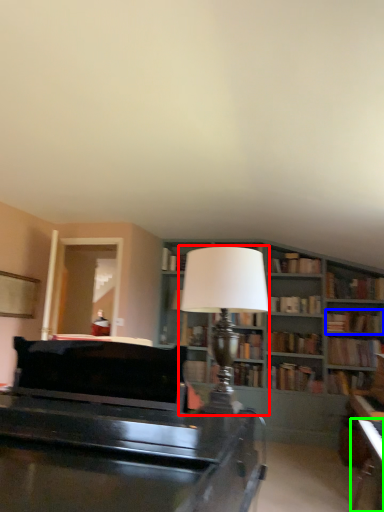
Question: Considering the real-world distances, which object is farthest from table lamp (highlighted by a red box)? book (highlighted by a blue box) or table (highlighted by a green box)?

Choices:
 (A) book
 (B) table

Answer: (A)